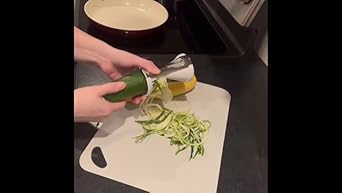
Locate an element on the screen. grey tabletop is located at coordinates (252, 152).